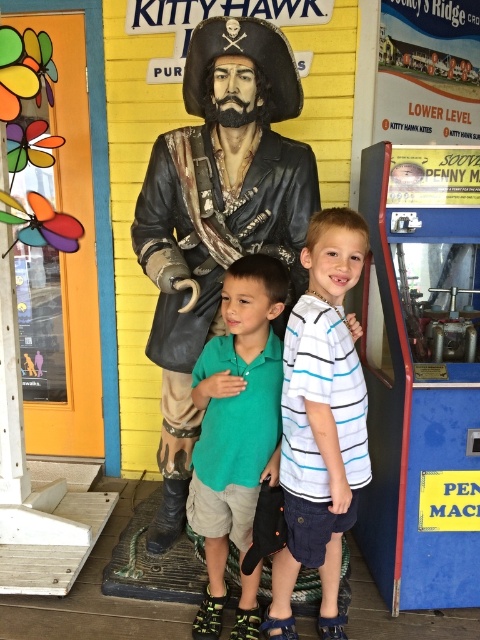
You are a photographer trying to capture a photo of the bronze pirate at center and the green cotton polo shirt at center. Which object is located to the right of the other?

The bronze pirate at center is positioned on the left side of green cotton polo shirt at center, so the green cotton polo shirt at center is to the right of the bronze pirate at center.

Looking at this image, you are a tailor who needs to determine if the bronze pirate at center can wear the green cotton polo shirt at center. Based on their widths, will the shirt fit the pirate?

The bronze pirate at center is wider than the green cotton polo shirt at center, so the shirt would be too small to fit the pirate.